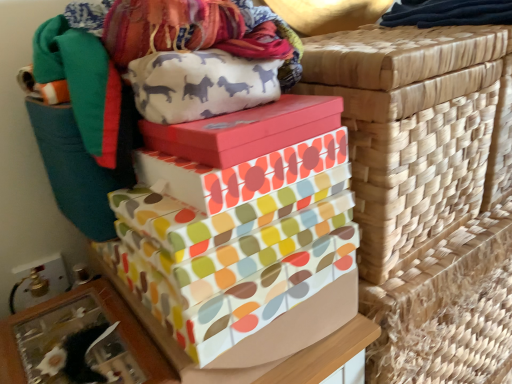
Locate an element on the screen. multicolored woven fabric at upper left is located at coordinates point(188,30).

What's the angular difference between woven straw basket at upper right and multicolored paper gift boxes at center, acting as the third gift box starting from the top,'s facing directions?

The angular difference between woven straw basket at upper right and multicolored paper gift boxes at center, acting as the third gift box starting from the top, is 3.49 degrees.

Is point (345, 47) positioned after point (154, 227)?

Yes, point (345, 47) is behind point (154, 227).

Can you confirm if woven straw basket at upper right is thinner than multicolored paper gift boxes at center, acting as the third gift box starting from the top?

No, woven straw basket at upper right is not thinner than multicolored paper gift boxes at center, acting as the third gift box starting from the top.

Considering the relative positions of woven straw basket at upper right and multicolored paper gift boxes at center, the 1th gift box from the bottom, in the image provided, is woven straw basket at upper right to the right of multicolored paper gift boxes at center, the 1th gift box from the bottom, from the viewer's perspective?

Indeed, woven straw basket at upper right is positioned on the right side of multicolored paper gift boxes at center, the 1th gift box from the bottom.

Is multicolored woven fabric at upper left oriented towards multicolored fabric gift box at center, the second gift box from the bottom?

No, multicolored woven fabric at upper left is not aimed at multicolored fabric gift box at center, the second gift box from the bottom.

Does multicolored woven fabric at upper left have a lesser height compared to multicolored fabric gift box at center, the 2th gift box viewed from the top?

No.

From a real-world perspective, between multicolored woven fabric at upper left and multicolored fabric gift box at center, the 2th gift box viewed from the top, who is vertically higher?

In real-world perspective, multicolored woven fabric at upper left is above.

Which of these two, multicolored fabric gift box at center, the 2th gift box viewed from the top, or multicolored woven fabric at upper left, is bigger?

With larger size is multicolored woven fabric at upper left.

From a real-world perspective, is multicolored fabric gift box at center, the second gift box from the bottom, located higher than multicolored woven fabric at upper left?

No, from a real-world perspective, multicolored fabric gift box at center, the second gift box from the bottom, is not over multicolored woven fabric at upper left

From the picture: From the image's perspective, is multicolored fabric gift box at center, the second gift box from the bottom, below multicolored woven fabric at upper left?

Yes, from the image's perspective, multicolored fabric gift box at center, the second gift box from the bottom, is below multicolored woven fabric at upper left.

Which of these two, multicolored fabric gift box at center, the 2th gift box viewed from the top, or multicolored woven fabric at upper left, is wider?

With larger width is multicolored woven fabric at upper left.

From the image's perspective, who appears lower, multicolored woven fabric at upper left or matte pink box at center, placed as the third gift box when sorted from bottom to top?

matte pink box at center, placed as the third gift box when sorted from bottom to top, from the image's perspective.

Considering the sizes of objects multicolored woven fabric at upper left and matte pink box at center, placed as the first gift box when sorted from top to bottom, in the image provided, who is bigger, multicolored woven fabric at upper left or matte pink box at center, placed as the first gift box when sorted from top to bottom,?

With larger size is multicolored woven fabric at upper left.

Which is behind, multicolored woven fabric at upper left or matte pink box at center, placed as the first gift box when sorted from top to bottom?

matte pink box at center, placed as the first gift box when sorted from top to bottom.

What's the angular difference between multicolored woven fabric at upper left and matte pink box at center, placed as the third gift box when sorted from bottom to top,'s facing directions?

0.00144 degrees.

Is point (291, 300) less distant than point (422, 86)?

Yes, it is.

From the image's perspective, does multicolored paper gift boxes at center, acting as the third gift box starting from the top, appear higher than woven straw basket at upper right?

No, from the image's perspective, multicolored paper gift boxes at center, acting as the third gift box starting from the top, is not on top of woven straw basket at upper right.

Which of these two, multicolored paper gift boxes at center, acting as the third gift box starting from the top, or woven straw basket at upper right, stands shorter?

multicolored paper gift boxes at center, acting as the third gift box starting from the top, is shorter.

Find the location of a particular element. the 2nd gift box located beneath the matte pink box at center, placed as the third gift box when sorted from bottom to top (from a real-world perspective) is located at coordinates (237, 224).

From a real-world perspective, who is located lower, matte pink box at center, placed as the third gift box when sorted from bottom to top, or multicolored paper gift boxes at center, the 1th gift box from the bottom?

From a 3D spatial view, multicolored paper gift boxes at center, the 1th gift box from the bottom, is below.

Considering the sizes of objects matte pink box at center, placed as the third gift box when sorted from bottom to top, and multicolored paper gift boxes at center, the 1th gift box from the bottom, in the image provided, who is bigger, matte pink box at center, placed as the third gift box when sorted from bottom to top, or multicolored paper gift boxes at center, the 1th gift box from the bottom,?

multicolored paper gift boxes at center, the 1th gift box from the bottom, is bigger.

From the picture: Is woven straw basket at upper right positioned behind multicolored woven fabric at upper left?

Yes.

Is woven straw basket at upper right facing towards multicolored woven fabric at upper left?

No, woven straw basket at upper right is not facing towards multicolored woven fabric at upper left.

Can you confirm if woven straw basket at upper right is taller than multicolored woven fabric at upper left?

Correct, woven straw basket at upper right is much taller as multicolored woven fabric at upper left.

From the image's perspective, starting from the woven straw basket at upper right, which gift box is the 3rd one below? Please provide its 2D coordinates.

[(237, 224)]

Locate an element on the screen. The image size is (512, 384). fabric lying in front of the multicolored fabric gift box at center, the second gift box from the bottom is located at coordinates (188, 30).

When comparing their distances from multicolored paper gift boxes at center, the 1th gift box from the bottom, does woven straw basket at upper right or multicolored fabric gift box at center, the second gift box from the bottom, seem closer?

Among the two, multicolored fabric gift box at center, the second gift box from the bottom, is located nearer to multicolored paper gift boxes at center, the 1th gift box from the bottom.

From the picture: Based on their spatial positions, is multicolored fabric gift box at center, the second gift box from the bottom, or matte pink box at center, placed as the first gift box when sorted from top to bottom, closer to woven straw basket at upper right?

matte pink box at center, placed as the first gift box when sorted from top to bottom, is positioned closer to the anchor woven straw basket at upper right.

Based on their spatial positions, is multicolored paper gift boxes at center, the 1th gift box from the bottom, or multicolored fabric gift box at center, the second gift box from the bottom, closer to multicolored woven fabric at upper left?

multicolored fabric gift box at center, the second gift box from the bottom, is closer to multicolored woven fabric at upper left.

Looking at this image, estimate the real-world distances between objects in this image. Which object is closer to woven straw basket at upper right, multicolored woven fabric at upper left or multicolored fabric gift box at center, the 2th gift box viewed from the top?

multicolored fabric gift box at center, the 2th gift box viewed from the top, is closer to woven straw basket at upper right.

Considering their positions, is multicolored paper gift boxes at center, acting as the third gift box starting from the top, positioned closer to multicolored woven fabric at upper left than woven straw basket at upper right?

multicolored paper gift boxes at center, acting as the third gift box starting from the top, is closer to multicolored woven fabric at upper left.

Which object lies nearer to the anchor point woven straw basket at upper right, multicolored fabric gift box at center, the 2th gift box viewed from the top, or multicolored paper gift boxes at center, acting as the third gift box starting from the top?

multicolored paper gift boxes at center, acting as the third gift box starting from the top, is closer to woven straw basket at upper right.

When comparing their distances from multicolored fabric gift box at center, the 2th gift box viewed from the top, does matte pink box at center, placed as the first gift box when sorted from top to bottom, or multicolored paper gift boxes at center, the 1th gift box from the bottom, seem further?

Among the two, multicolored paper gift boxes at center, the 1th gift box from the bottom, is located further to multicolored fabric gift box at center, the 2th gift box viewed from the top.

Estimate the real-world distances between objects in this image. Which object is closer to multicolored woven fabric at upper left, multicolored fabric gift box at center, the second gift box from the bottom, or woven straw basket at upper right?

The object closer to multicolored woven fabric at upper left is multicolored fabric gift box at center, the second gift box from the bottom.

Identify the location of gift box between matte pink box at center, placed as the first gift box when sorted from top to bottom, and multicolored paper gift boxes at center, the 1th gift box from the bottom, from top to bottom. (239, 173).

This screenshot has height=384, width=512. In order to click on gift box between multicolored woven fabric at upper left and multicolored fabric gift box at center, the 2th gift box viewed from the top, from top to bottom in this screenshot , I will do `click(246, 130)`.

Locate an element on the screen. The image size is (512, 384). gift box between multicolored fabric gift box at center, the second gift box from the bottom, and woven straw basket at upper right from left to right is located at coordinates (246, 130).